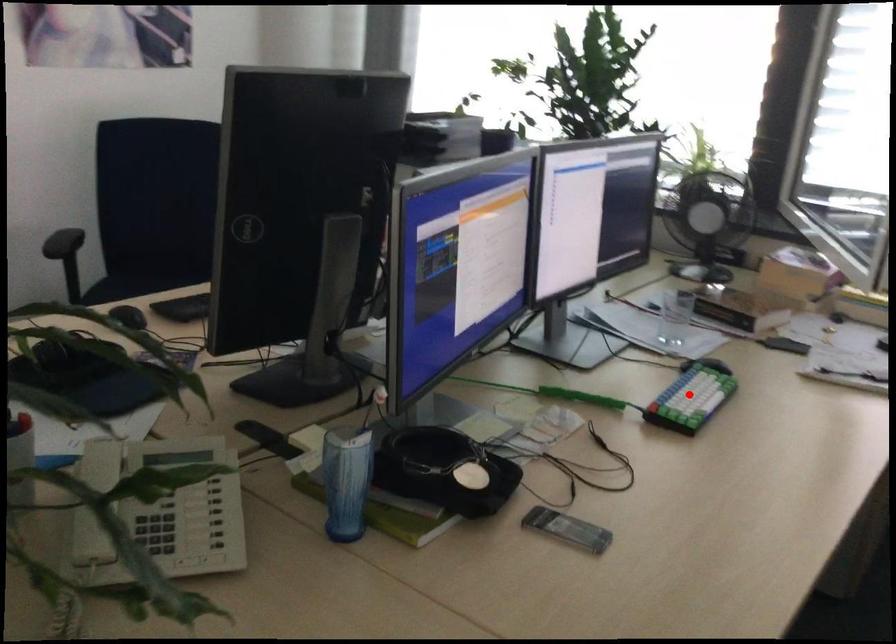
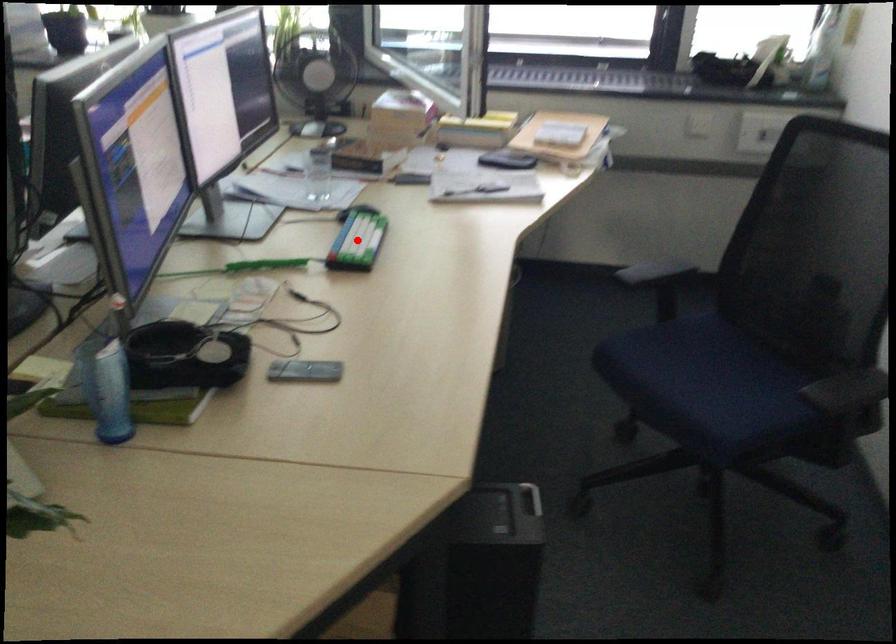
I am providing you with two images of the same scene from different viewpoints. A red point is marked on the first image and another point is marked on the second image. Is the marked point in image1 the same physical position as the marked point in image2?

Yes